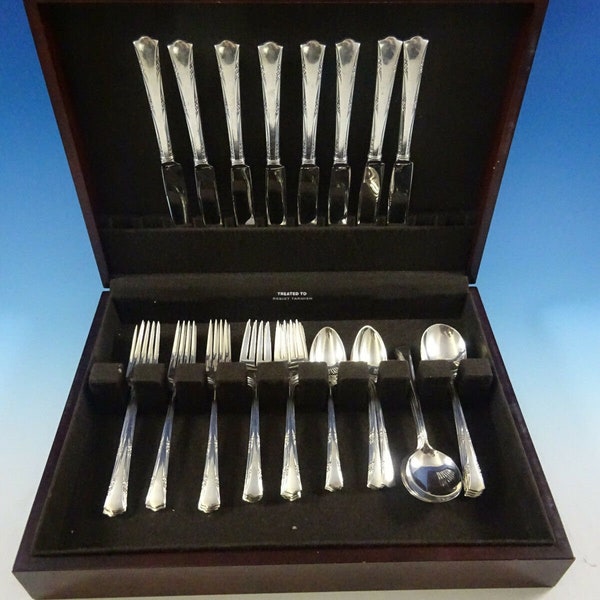
Where is `spoons`? spoons is located at coordinates (332, 353), (361, 348), (432, 467), (447, 331).